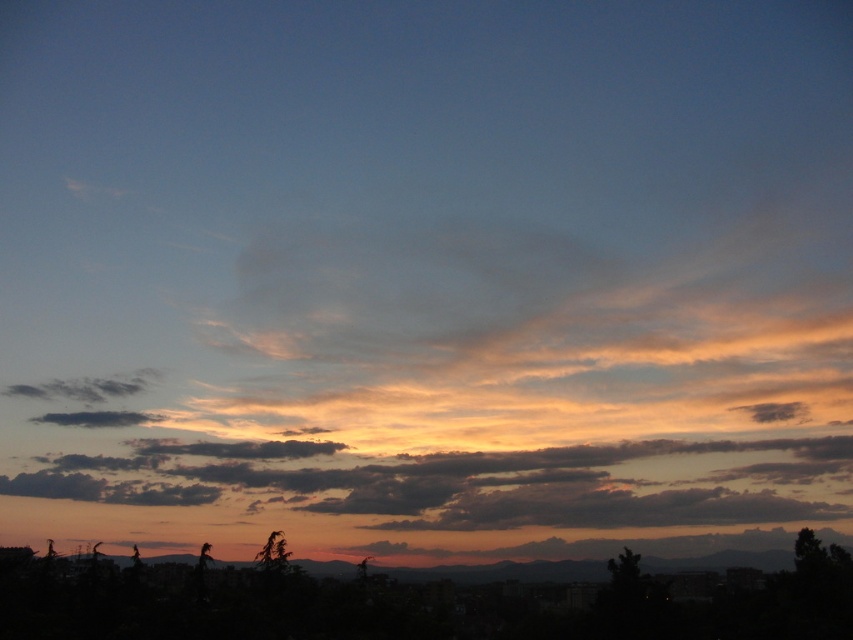
You are an artist trying to paint the sunset scene. You notice the translucent orange cloud at upper center and the cloudy orange sky at center. Which one should you paint larger to accurately represent their sizes in the scene?

The translucent orange cloud at upper center should be painted larger than the cloudy orange sky at center as it is bigger in the scene.

Based on the scene, which object has a greater height between the translucent orange cloud at upper center and the cloudy orange sky at center?

The translucent orange cloud at upper center has a greater height compared to the cloudy orange sky at center according to the description.

You are an astronomer observing the sunset and notice the translucent orange cloud at upper center and the cloudy orange sky at center. Which object is positioned higher in the sky?

The translucent orange cloud at upper center is positioned higher in the sky than the cloudy orange sky at center because it is located above it.